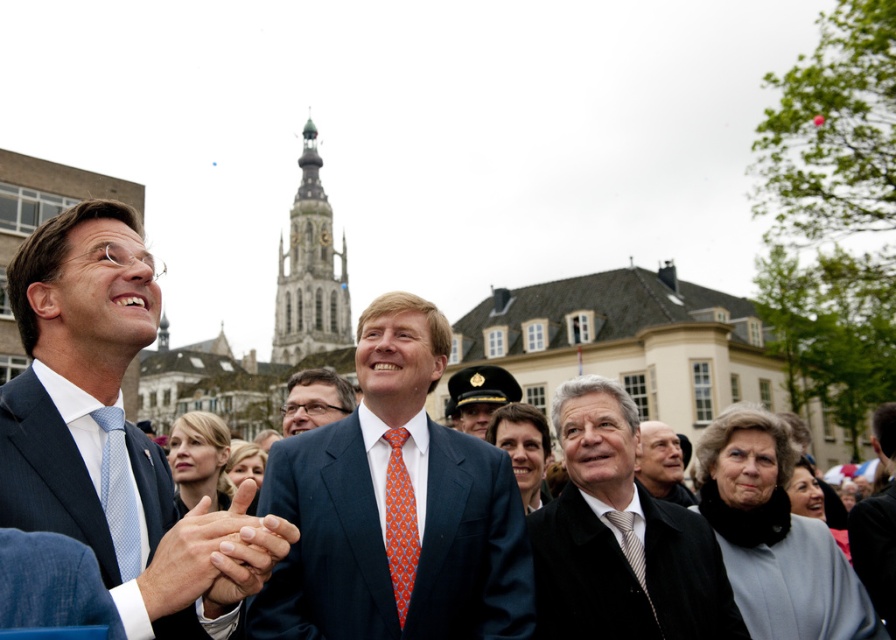
Question: Based on their relative distances, which object is farther from the striped silk tie at center?

Choices:
 (A) navy blue suit at center
 (B) dark gray wool coat at center

Answer: (A)

Question: Is orange printed tie at center above striped silk tie at center?

Choices:
 (A) yes
 (B) no

Answer: (A)

Question: Is gray woolen scarf at lower right to the left of orange printed tie at center from the viewer's perspective?

Choices:
 (A) no
 (B) yes

Answer: (A)

Question: Can you confirm if dark gray wool coat at center is thinner than striped silk tie at center?

Choices:
 (A) no
 (B) yes

Answer: (A)

Question: Estimate the real-world distances between objects in this image. Which object is farther from the orange printed tie at center?

Choices:
 (A) navy blue suit at center
 (B) smooth skin hands at center

Answer: (B)

Question: Which of the following is the farthest from the observer?

Choices:
 (A) (360, 628)
 (B) (115, 540)
 (C) (483, 380)
 (D) (191, 531)

Answer: (C)